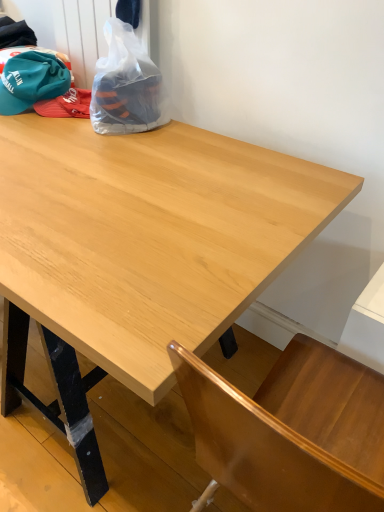
Question: Can you confirm if light wood table at center is shorter than teal fabric baseball hat at upper left?

Choices:
 (A) yes
 (B) no

Answer: (B)

Question: Does light wood table at center have a lesser width compared to teal fabric baseball hat at upper left?

Choices:
 (A) no
 (B) yes

Answer: (A)

Question: From a real-world perspective, does light wood table at center sit lower than teal fabric baseball hat at upper left?

Choices:
 (A) no
 (B) yes

Answer: (B)

Question: Is teal fabric baseball hat at upper left surrounded by light wood table at center?

Choices:
 (A) yes
 (B) no

Answer: (B)

Question: From the image's perspective, does light wood table at center appear higher than teal fabric baseball hat at upper left?

Choices:
 (A) yes
 (B) no

Answer: (B)

Question: Is point (57, 73) closer or farther from the camera than point (92, 258)?

Choices:
 (A) farther
 (B) closer

Answer: (A)

Question: In terms of height, does teal fabric baseball hat at upper left look taller or shorter compared to light wood table at center?

Choices:
 (A) tall
 (B) short

Answer: (B)

Question: Considering the relative positions of teal fabric baseball hat at upper left and light wood table at center in the image provided, is teal fabric baseball hat at upper left to the left or to the right of light wood table at center?

Choices:
 (A) left
 (B) right

Answer: (A)

Question: Looking at the image, does teal fabric baseball hat at upper left seem bigger or smaller compared to light wood table at center?

Choices:
 (A) big
 (B) small

Answer: (B)

Question: In the image, is transparent plastic bag at upper left positioned in front of or behind light wood table at center?

Choices:
 (A) behind
 (B) front

Answer: (A)

Question: From the image's perspective, relative to light wood table at center, is transparent plastic bag at upper left above or below?

Choices:
 (A) above
 (B) below

Answer: (A)

Question: From a real-world perspective, is transparent plastic bag at upper left physically located above or below light wood table at center?

Choices:
 (A) below
 (B) above

Answer: (B)

Question: Looking at their shapes, would you say transparent plastic bag at upper left is wider or thinner than light wood table at center?

Choices:
 (A) thin
 (B) wide

Answer: (A)

Question: In the image, is light wood table at center on the left side or the right side of teal fabric baseball hat at upper left?

Choices:
 (A) right
 (B) left

Answer: (A)

Question: Considering their positions, is light wood table at center located in front of or behind teal fabric baseball hat at upper left?

Choices:
 (A) behind
 (B) front

Answer: (B)